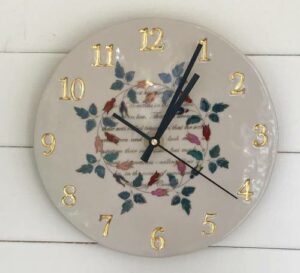
Where is `wall`? The width and height of the screenshot is (300, 273). wall is located at coordinates (54, 40).